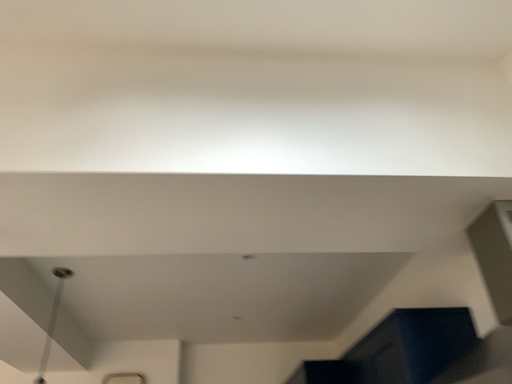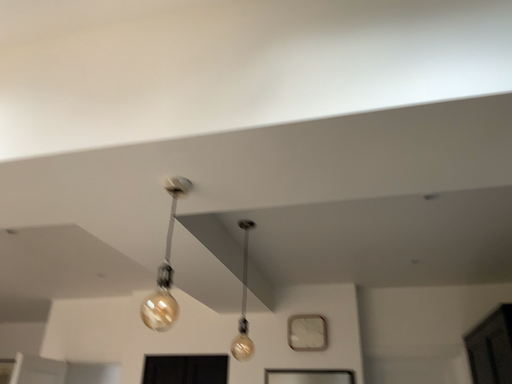
Question: How did the camera likely rotate when shooting the video?

Choices:
 (A) rotated right
 (B) rotated left

Answer: (B)